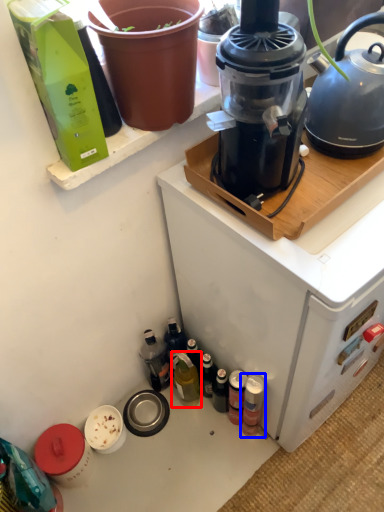
Question: Which object appears farthest to the camera in this image, bottle (highlighted by a red box) or bottle (highlighted by a blue box)?

Choices:
 (A) bottle
 (B) bottle

Answer: (A)